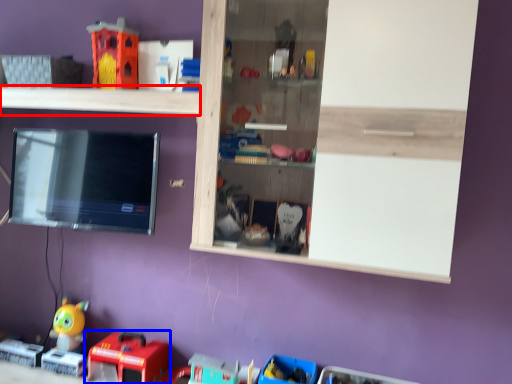
Question: Among these objects, which one is nearest to the camera, shelf (highlighted by a red box) or toy (highlighted by a blue box)?

Choices:
 (A) shelf
 (B) toy

Answer: (A)